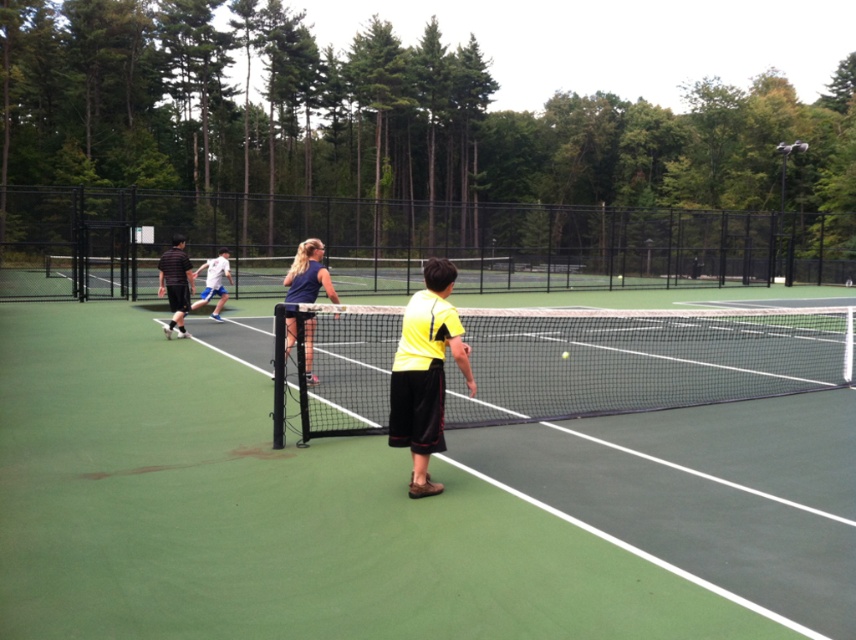
Can you confirm if green synthetic surface at center is smaller than dark blue jersey at center?

Actually, green synthetic surface at center might be larger than dark blue jersey at center.

Can you confirm if green synthetic surface at center is positioned above dark blue jersey at center?

No.

Measure the distance between point [654,531] and camera.

A distance of 5.18 meters exists between point [654,531] and camera.

The width and height of the screenshot is (856, 640). Identify the location of green synthetic surface at center. (388, 504).

Where is `green synthetic surface at center`? Image resolution: width=856 pixels, height=640 pixels. green synthetic surface at center is located at coordinates (388, 504).

Does green synthetic surface at center have a lesser width compared to black mesh tennis net at center?

No, green synthetic surface at center is not thinner than black mesh tennis net at center.

Is point (378, 300) closer to camera compared to point (482, 321)?

No, (378, 300) is further to viewer.

Where is `green synthetic surface at center`? green synthetic surface at center is located at coordinates (388, 504).

Which of these two, yellow matte shirt at center or white cotton shirt at center, stands shorter?

Standing shorter between the two is white cotton shirt at center.

The height and width of the screenshot is (640, 856). I want to click on yellow matte shirt at center, so click(x=425, y=372).